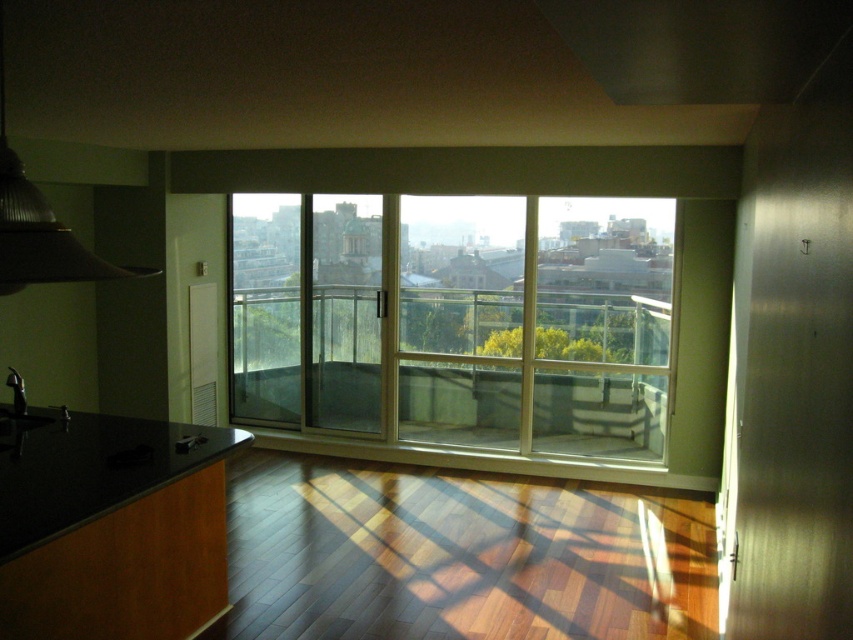
You are trying to decide where to place a new wide bookshelf in the room. The bookshelf is 2 meters wide. You see the clear glass window at center and the black granite countertop at lower left. Which object is wider so that the bookshelf can be placed next to it?

The clear glass window at center might be wider than black granite countertop at lower left, so placing the bookshelf next to the clear glass window at center is more likely to accommodate its width.

You are a delivery person entering the room and need to place a package on the black granite countertop at lower left. The clear glass window at center is in your way. Can you move around it to reach the countertop?

The clear glass window at center is to the right of the black granite countertop at lower left, so you can move around the left side of the clear glass window at center to access the black granite countertop at lower left.